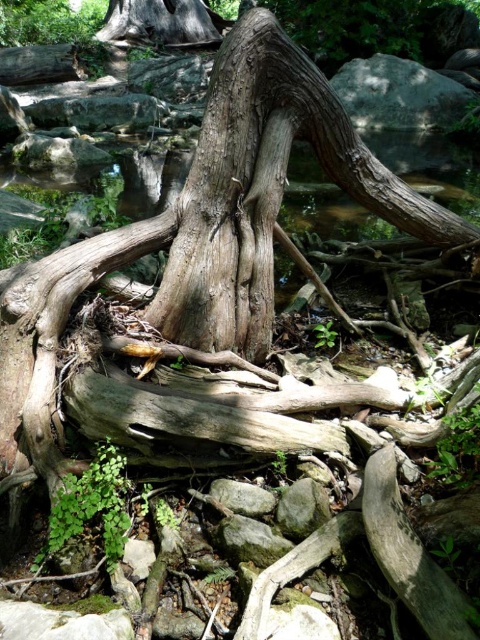
Does gray rough rock at upper center have a lesser width compared to gray rough rock at center?

No, gray rough rock at upper center is not thinner than gray rough rock at center.

This screenshot has height=640, width=480. Describe the element at coordinates (398, 93) in the screenshot. I see `gray rough rock at upper center` at that location.

Is point (374, 61) positioned after point (256, 508)?

Yes.

At what (x,y) coordinates should I click in order to perform the action: click on gray rough rock at upper center. Please return your answer as a coordinate pair (x, y). Looking at the image, I should click on tap(398, 93).